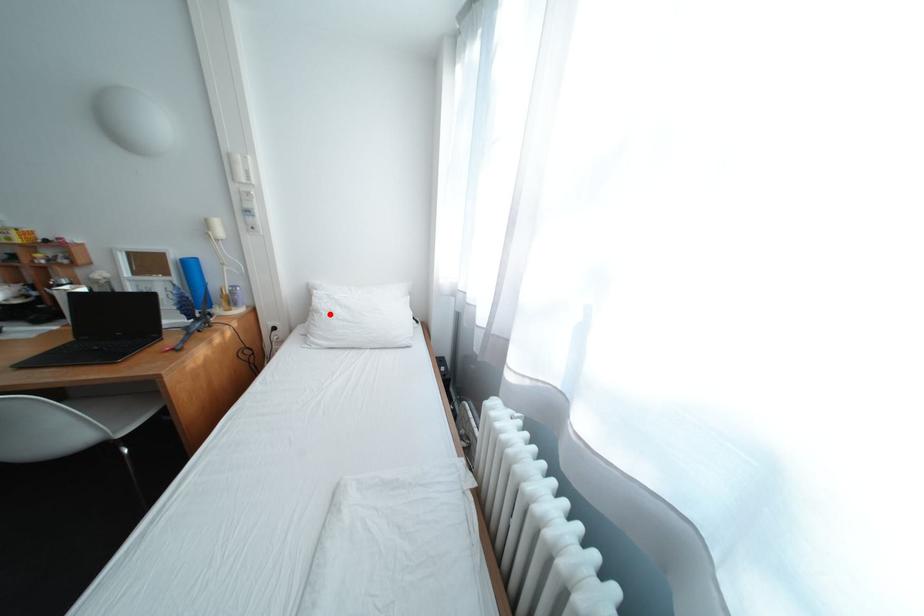
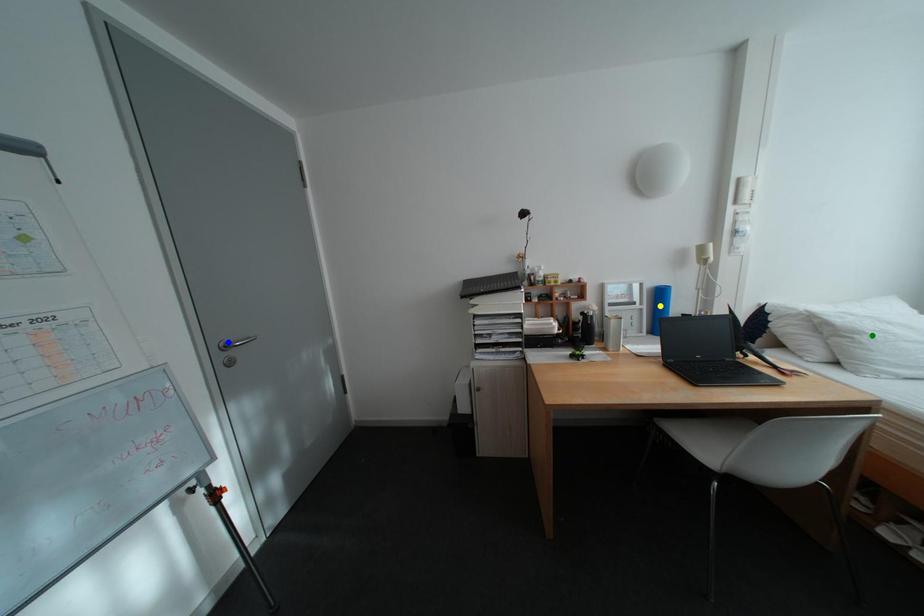
Question: I am providing you with two images of the same scene from different viewpoints. A red point is marked on the first image. You are given multiple points on the second image. Can you choose the point in image 2 that corresponds to the point in image 1?

Choices:
 (A) green point
 (B) yellow point
 (C) blue point

Answer: (A)